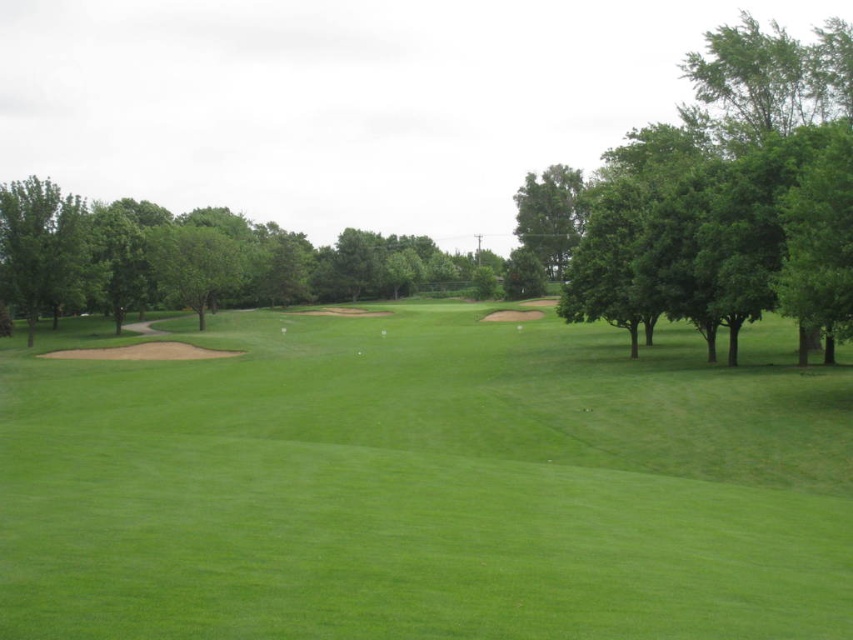
Who is positioned more to the left, green leafy tree at left or green leafy tree at upper center?

Positioned to the left is green leafy tree at left.

Can you confirm if green leafy tree at left is positioned to the left of green leafy tree at upper center?

Indeed, green leafy tree at left is positioned on the left side of green leafy tree at upper center.

This screenshot has height=640, width=853. I want to click on green leafy tree at left, so [x=184, y=259].

Between green leafy tree at right and green leafy tree at upper center, which one appears on the left side from the viewer's perspective?

green leafy tree at upper center is more to the left.

Does green leafy tree at right appear on the right side of green leafy tree at upper center?

Correct, you'll find green leafy tree at right to the right of green leafy tree at upper center.

Is point (741, 36) farther from viewer compared to point (556, 253)?

No, (741, 36) is closer to viewer.

Find the location of a particular element. green leafy tree at right is located at coordinates pos(711,184).

Is green grassy field at center positioned in front of green leafy tree at upper center?

Yes, green grassy field at center is closer to the viewer.

Is point (560, 547) closer to viewer compared to point (548, 262)?

Yes, it is.

Does point (248, 595) come closer to viewer compared to point (556, 214)?

Yes, it is.

Where is `green grassy field at center`? Image resolution: width=853 pixels, height=640 pixels. green grassy field at center is located at coordinates (424, 483).